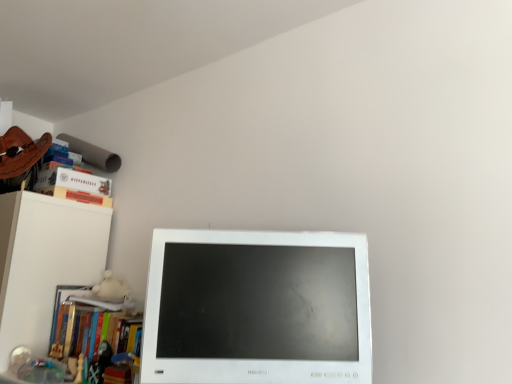
Question: Considering the relative positions of hardcover book at upper left, arranged as the 2th paperback book when ordered from the bottom, and hardcover book at upper left, which is counted as the second paperback book, starting from the top, in the image provided, is hardcover book at upper left, arranged as the 2th paperback book when ordered from the bottom, in front of hardcover book at upper left, which is counted as the second paperback book, starting from the top,?

Choices:
 (A) no
 (B) yes

Answer: (A)

Question: From the image's perspective, is hardcover book at upper left, the 1th paperback book viewed from the top, located beneath hardcover book at upper left, which is counted as the second paperback book, starting from the top?

Choices:
 (A) no
 (B) yes

Answer: (A)

Question: Is hardcover book at upper left, which is counted as the first paperback book, starting from the bottom, completely or partially inside hardcover book at upper left, arranged as the 2th paperback book when ordered from the bottom?

Choices:
 (A) yes
 (B) no

Answer: (B)

Question: Are hardcover book at upper left, arranged as the 2th paperback book when ordered from the bottom, and hardcover book at upper left, which is counted as the second paperback book, starting from the top, located far from each other?

Choices:
 (A) yes
 (B) no

Answer: (B)

Question: Does hardcover book at upper left, arranged as the 2th paperback book when ordered from the bottom, have a greater height compared to hardcover book at upper left, which is counted as the second paperback book, starting from the top?

Choices:
 (A) yes
 (B) no

Answer: (A)

Question: Is hardcover book at upper left, the 1th paperback book viewed from the top, smaller than hardcover book at upper left, which is counted as the second paperback book, starting from the top?

Choices:
 (A) no
 (B) yes

Answer: (A)

Question: From a real-world perspective, is wooden chess piece at lower left positioned over hardcover book at left, the first book from the bottom, based on gravity?

Choices:
 (A) no
 (B) yes

Answer: (A)

Question: Is wooden chess piece at lower left oriented away from hardcover book at left, the first book from the bottom?

Choices:
 (A) yes
 (B) no

Answer: (A)

Question: From a real-world perspective, is wooden chess piece at lower left physically below hardcover book at left, the first book from the bottom?

Choices:
 (A) yes
 (B) no

Answer: (A)

Question: Can you confirm if wooden chess piece at lower left is shorter than hardcover book at left, the first book from the bottom?

Choices:
 (A) yes
 (B) no

Answer: (A)

Question: Does wooden chess piece at lower left have a larger size compared to hardcover book at left, the first book from the bottom?

Choices:
 (A) no
 (B) yes

Answer: (A)

Question: Is wooden chess piece at lower left to the left of hardcover book at left, which is the second book in top-to-bottom order, from the viewer's perspective?

Choices:
 (A) no
 (B) yes

Answer: (B)

Question: Is wooden chess piece at lower left to the left of hardcover book at upper left, which is counted as the first paperback book, starting from the bottom, from the viewer's perspective?

Choices:
 (A) yes
 (B) no

Answer: (B)